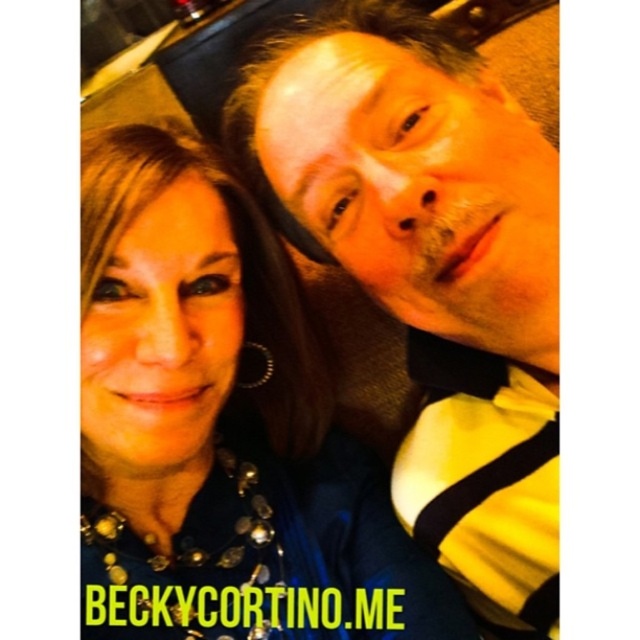
You are a photographer trying to capture a group photo of the blue fabric at center and the yellow striped shirt at upper right. Since you want to ensure both subjects are clearly visible, which object should you focus on first considering their sizes?

The blue fabric at center has a larger width than the yellow striped shirt at upper right, so you should focus on the blue fabric at center first to ensure its details are sharp before adjusting for the smaller subject.

You are a photographer trying to adjust the composition of this selfie. You want to ensure there is at least 6 inches of space between the blue fabric at center and the yellow striped shirt at upper right for better aesthetics. Based on the current setup, is this requirement met?

The blue fabric at center is 5.79 inches away from the yellow striped shirt at upper right, which is less than the required 6 inches. Therefore, the requirement is not met.

You are standing in a room and see the blue fabric at center and the yellow striped shirt at upper right. Which object is located to the left of the other?

The blue fabric at center is positioned on the left side of yellow striped shirt at upper right.